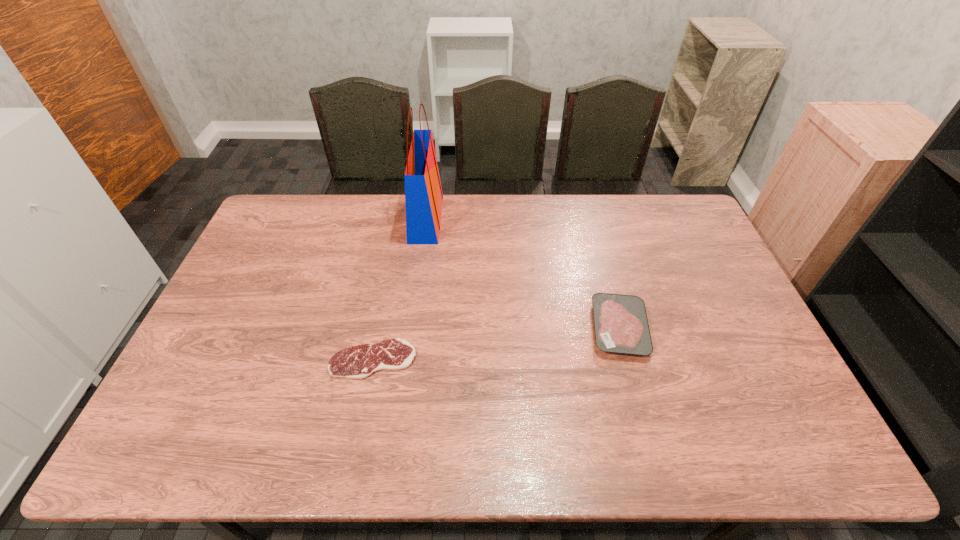
Identify the location of free region at the far edge of the desktop. This screenshot has height=540, width=960. (563, 204).

Where is `free spot at the near edge of the desktop`? Image resolution: width=960 pixels, height=540 pixels. free spot at the near edge of the desktop is located at coordinates (651, 443).

This screenshot has width=960, height=540. In the image, there is a desktop. Identify the location of vacant area at the left edge. (250, 295).

Where is `vacant space at the right edge of the desktop`? The width and height of the screenshot is (960, 540). vacant space at the right edge of the desktop is located at coordinates (683, 279).

Identify the location of vacant position at the far left corner of the desktop. Image resolution: width=960 pixels, height=540 pixels. (292, 233).

The width and height of the screenshot is (960, 540). What are the coordinates of `empty space between the taller steak and the farthest object` in the screenshot? It's located at (522, 274).

Identify the location of empty space between the taller steak and the left steak. (496, 344).

Where is `empty space that is in between the rightmost object and the shorter steak`? empty space that is in between the rightmost object and the shorter steak is located at coordinates (496, 344).

This screenshot has width=960, height=540. I want to click on free area in between the farthest object and the rightmost object, so click(522, 274).

What are the coordinates of `vacant region between the shortest object and the tallest object` in the screenshot? It's located at (399, 289).